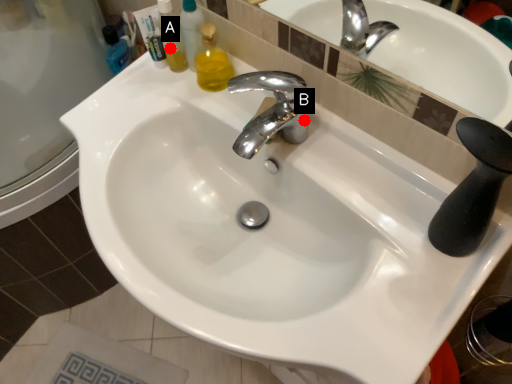
Question: Two points are circled on the image, labeled by A and B beside each circle. Which point is closer to the camera taking this photo?

Choices:
 (A) A is closer
 (B) B is closer

Answer: (B)